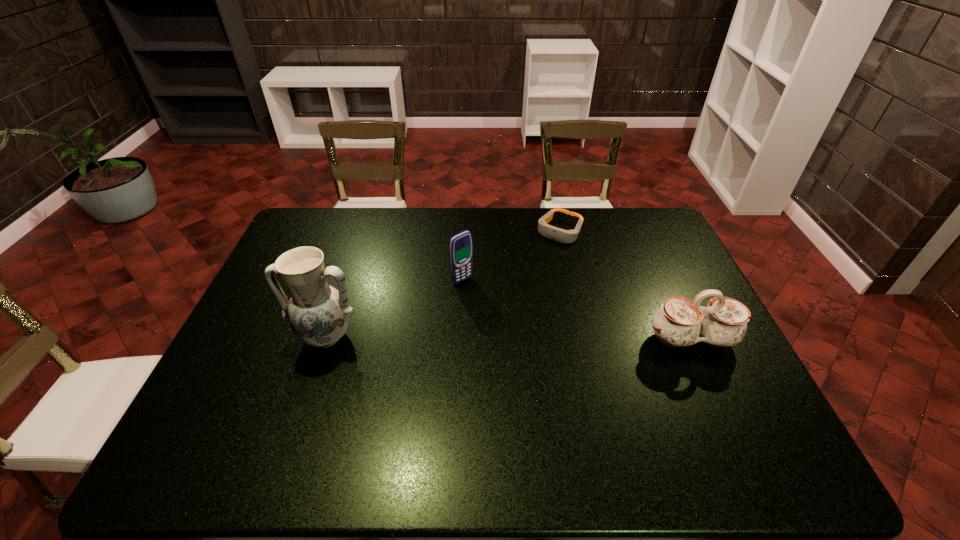
You are a GUI agent. You are given a task and a screenshot of the screen. Output one action in this format:
    pyautogui.click(x=<x>, y=<y>)
    Task: Click on the blank area located on the front and back of the goggles
    The width and height of the screenshot is (960, 540).
    Given the screenshot: What is the action you would take?
    pyautogui.click(x=522, y=282)

Identify the location of vacant space located on the front and back of the goggles. This screenshot has width=960, height=540. (506, 303).

In order to click on free space located on the front-facing side of the cellular telephone in this screenshot , I will do `click(542, 348)`.

The image size is (960, 540). Identify the location of free space located 0.290m on the front-facing side of the cellular telephone. (535, 341).

The width and height of the screenshot is (960, 540). I want to click on free space located 0.310m on the front-facing side of the cellular telephone, so click(x=540, y=346).

Identify the location of object positioned at the far edge. (565, 236).

At what (x,y) coordinates should I click in order to perform the action: click on object present at the left edge. Please return your answer as a coordinate pair (x, y). The width and height of the screenshot is (960, 540). Looking at the image, I should click on (318, 314).

Locate an element on the screen. object that is at the right edge is located at coordinates (680, 322).

The height and width of the screenshot is (540, 960). What are the coordinates of `free space at the far edge of the desktop` in the screenshot? It's located at (597, 234).

The image size is (960, 540). I want to click on vacant space at the near edge of the desktop, so click(683, 424).